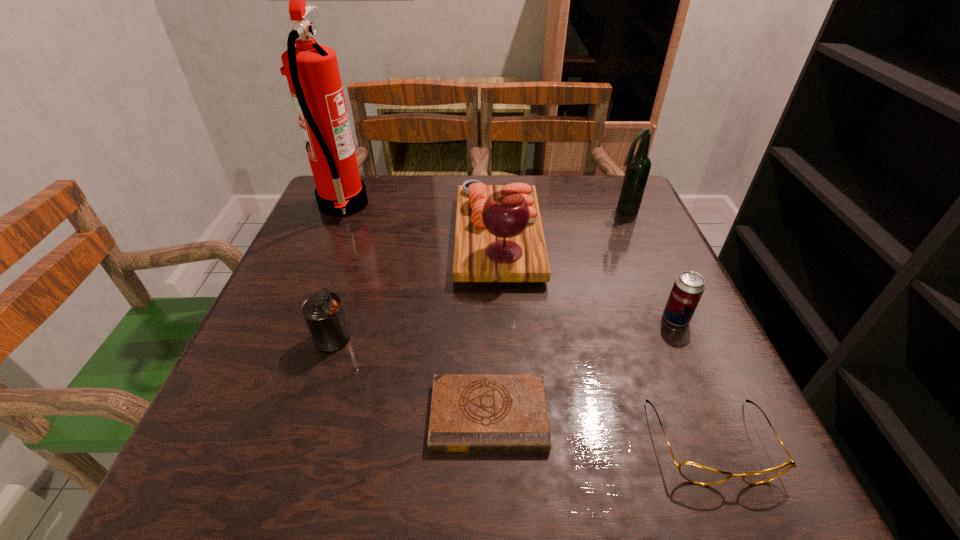
I want to click on vacant space at the far left corner of the desktop, so click(x=368, y=178).

You are a GUI agent. You are given a task and a screenshot of the screen. Output one action in this format:
    pyautogui.click(x=<x>, y=<y>)
    Task: Click on the vacant space at the near left corner of the desktop
    This screenshot has width=960, height=540.
    Given the screenshot: What is the action you would take?
    tap(284, 444)

Find the location of `blank region between the can and the beer can`. blank region between the can and the beer can is located at coordinates (504, 328).

Locate an element on the screen. The image size is (960, 540). free space between the spectacles and the beer can is located at coordinates (693, 380).

Find the location of a particular element. Image resolution: width=960 pixels, height=540 pixels. free space that is in between the third tallest object and the can is located at coordinates (416, 288).

Locate an element on the screen. free space between the beer bottle and the beer can is located at coordinates coord(650,264).

Find the location of a particular element. Image resolution: width=960 pixels, height=540 pixels. vacant area between the beer can and the beer bottle is located at coordinates (650, 264).

This screenshot has width=960, height=540. Find the location of `free space that is in between the platter and the can`. free space that is in between the platter and the can is located at coordinates (416, 288).

Locate an element on the screen. The image size is (960, 540). vacant space that's between the sixth shortest object and the third tallest object is located at coordinates (562, 223).

This screenshot has width=960, height=540. What are the coordinates of `the sixth closest object to the shortest object` in the screenshot? It's located at (638, 167).